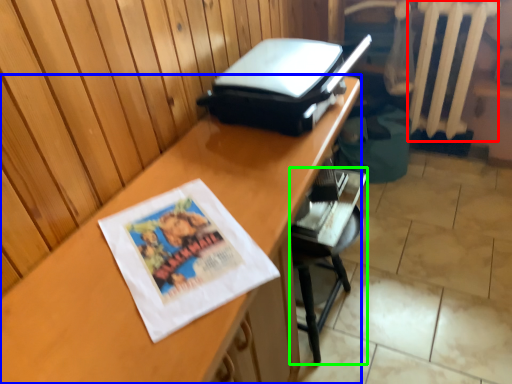
Question: Which object is the closest to the radiator (highlighted by a red box)? Choose among these: desk (highlighted by a blue box) or furniture (highlighted by a green box).

Choices:
 (A) desk
 (B) furniture

Answer: (B)